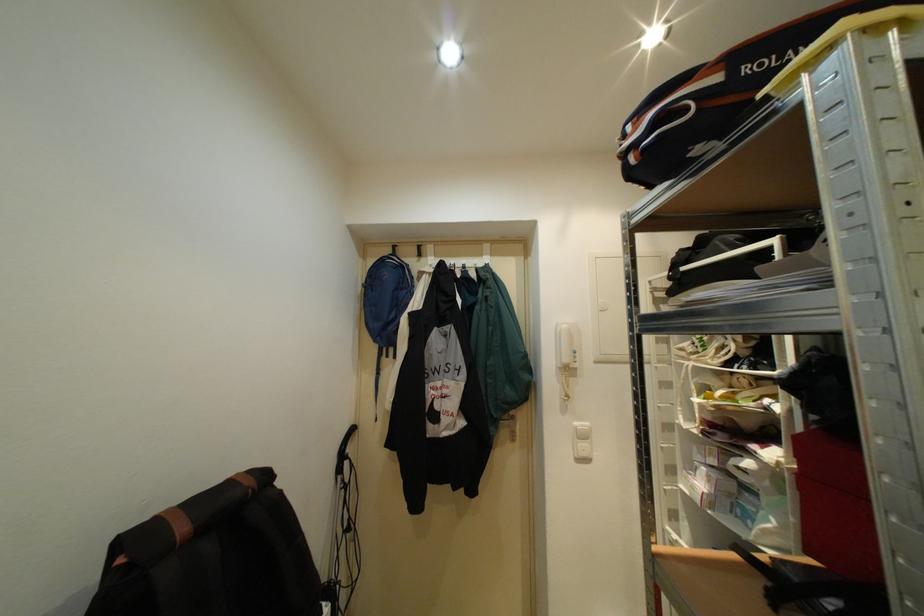
Describe the element at coordinates (379, 251) in the screenshot. I see `a bag handle` at that location.